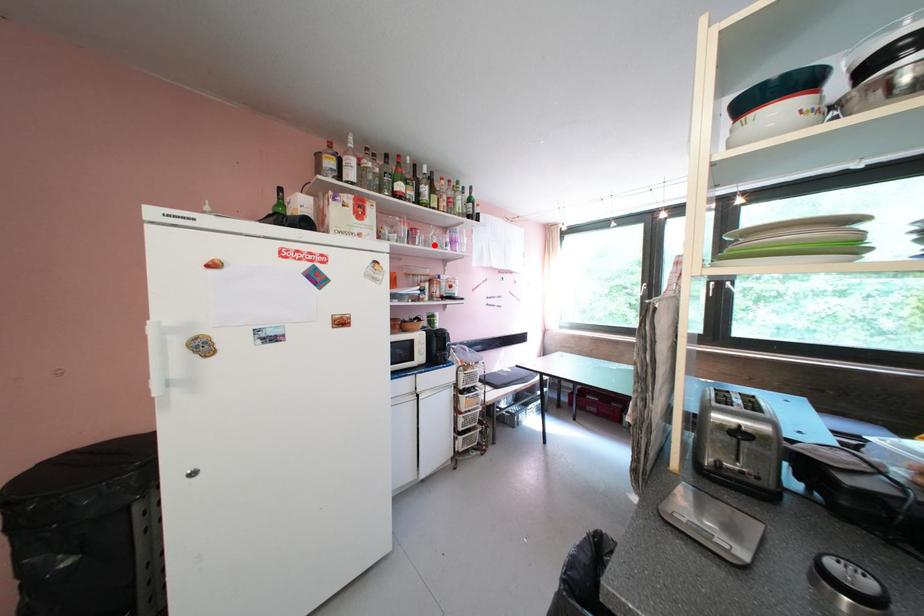
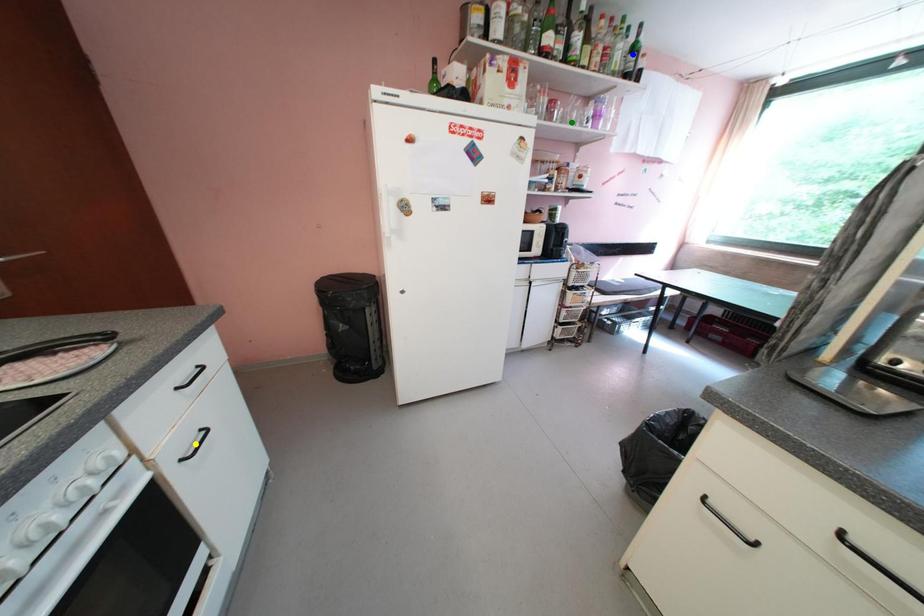
Question: I am providing you with two images of the same scene from different viewpoints. A red point is marked on the first image. You are given multiple points on the second image. Which point in image 2 is actually the same real-world point as the red point in image 1?

Choices:
 (A) yellow point
 (B) green point
 (C) blue point

Answer: (B)